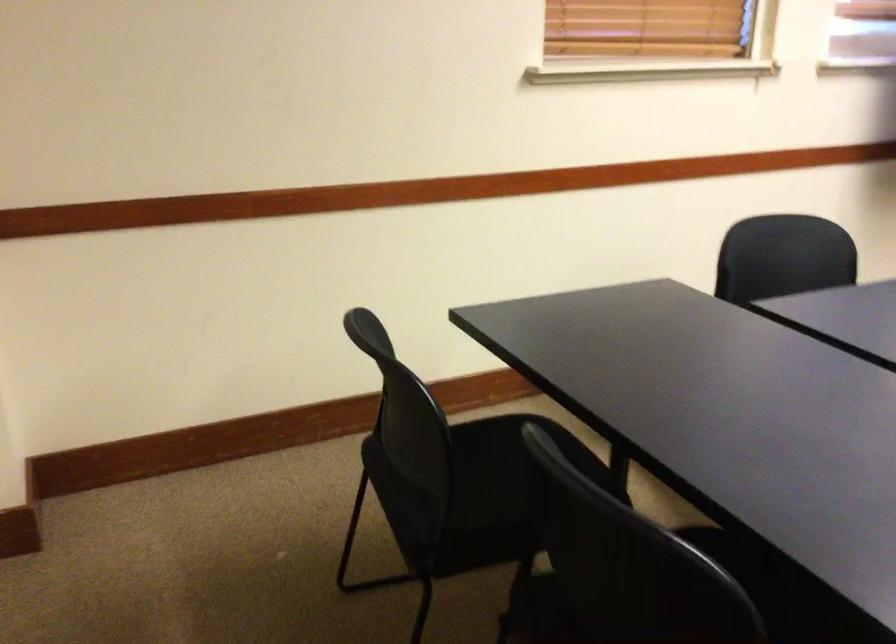
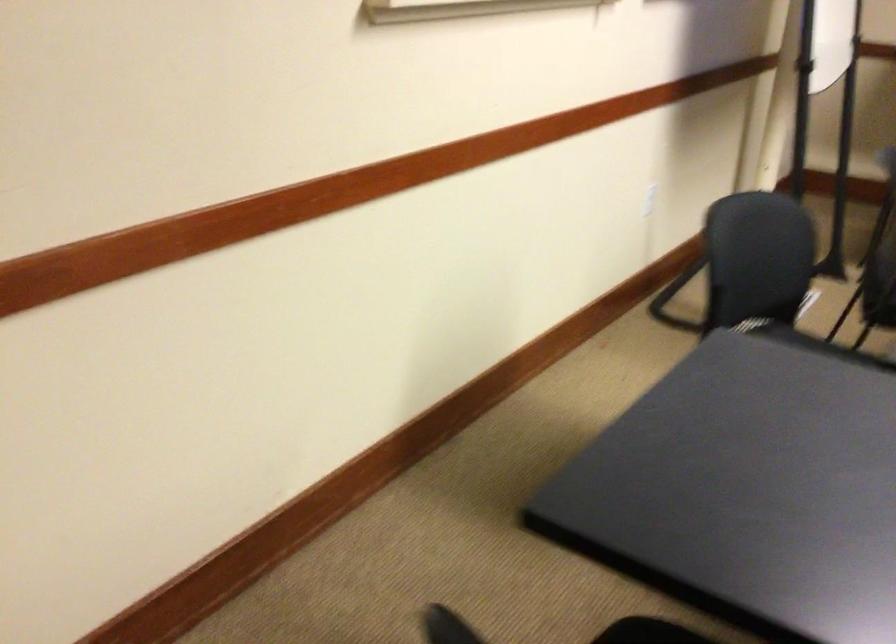
How did the camera likely rotate?

The camera's rotation is toward right-down.